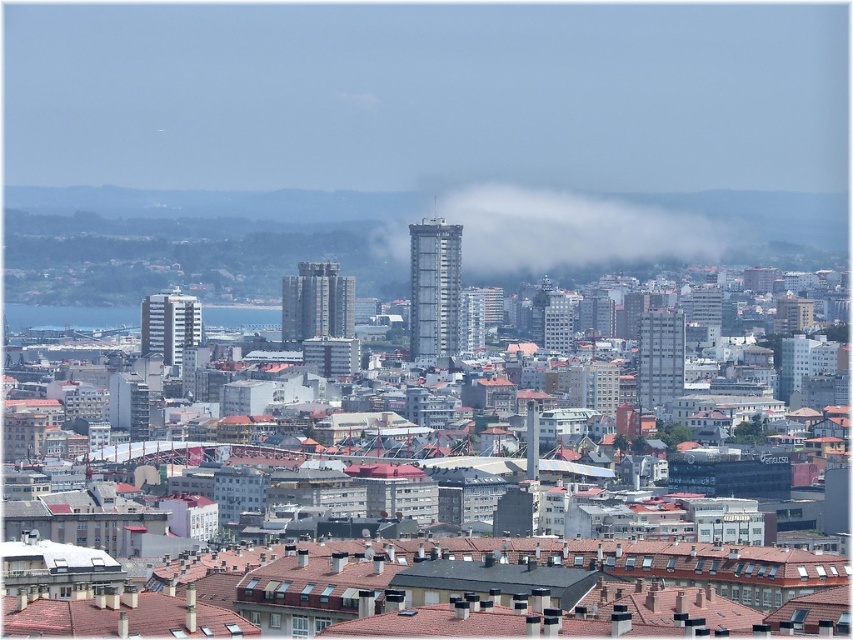
Question: Which point is closer to the camera?

Choices:
 (A) white misty cloud at center
 (B) blue water at center

Answer: (A)

Question: Does white misty cloud at center have a lesser width compared to blue water at center?

Choices:
 (A) yes
 (B) no

Answer: (B)

Question: Which point is farther from the camera taking this photo?

Choices:
 (A) (502, 205)
 (B) (109, 308)

Answer: (B)

Question: Is white misty cloud at center to the left of blue water at center from the viewer's perspective?

Choices:
 (A) no
 (B) yes

Answer: (A)

Question: Is white misty cloud at center thinner than blue water at center?

Choices:
 (A) no
 (B) yes

Answer: (A)